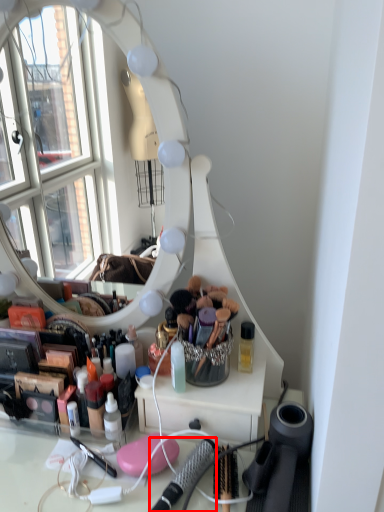
Question: From the image's perspective, considering the relative positions of brush (annotated by the red box) and toiletry in the image provided, where is brush (annotated by the red box) located with respect to the staircase?

Choices:
 (A) above
 (B) below

Answer: (B)